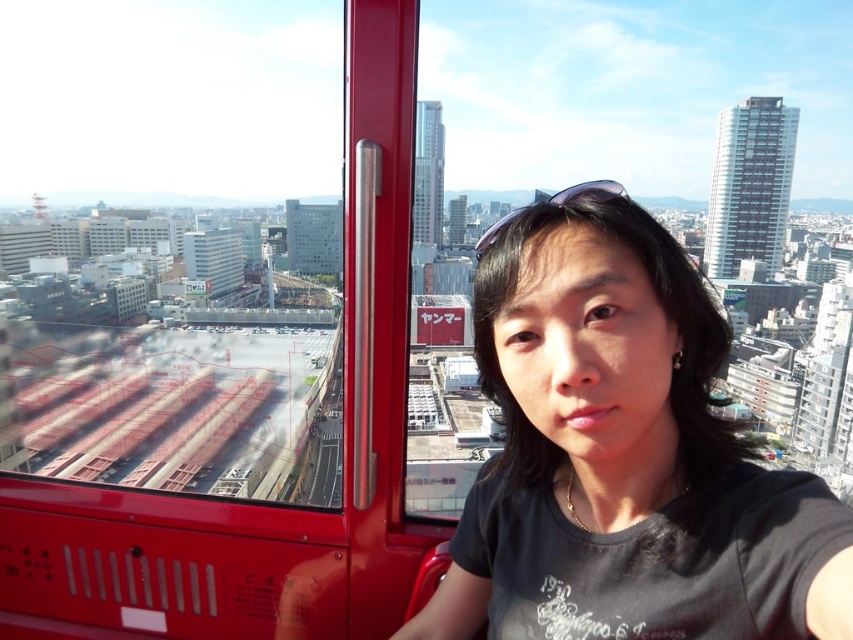
You are inside the red observation cabin and want to take a selfie with the city skyline visible through the transparent glass window at upper center. Where should you position yourself to ensure the window is in the frame?

The transparent glass window at upper center is located at point (177, 244), so you should position yourself near that coordinate to ensure the window is in the frame.

You are trying to take a selfie inside the red observation cabin. You want to include both the transparent glass window at upper center and the black matte shirt at center in the frame. Which object should you position closer to the left side of the camera to ensure both are visible?

To include both the transparent glass window at upper center and the black matte shirt at center in the frame, you should position the transparent glass window at upper center closer to the left side of the camera since it is already to the left of the black matte shirt at center.